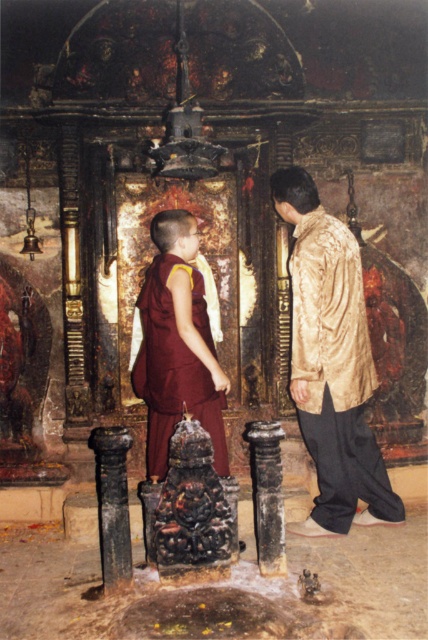
You are standing at the entrance of the temple and want to take a photo of the point at coordinates (x=350, y=384). The camera you have can only focus on objects within 5 meters. Will the point be in focus?

The distance of point (x=350, y=384) from camera is 5.61 meters, which is beyond the camera focus range of 5 meters. Therefore, the point will not be in focus.

You are a temple guide who needs to ensure visitors maintain a minimum distance of 3 feet between themselves and the sacred altar. You notice two people wearing the gold silk robe at right and the maroon cotton robe at center. Are they complying with the distance requirement?

The gold silk robe at right and maroon cotton robe at center are 34.56 inches apart. Since 34.56 inches is equal to 2.88 feet, which is less than the required 3 feet, they are not complying with the distance requirement.

You are a visitor in this temple and want to approach the altar. There is a gold silk robe at right and a maroon cotton robe at center. Which robe is closer to the altar?

The maroon cotton robe at center is closer to the altar because the gold silk robe at right is positioned to its right, meaning it is further away from the altar.